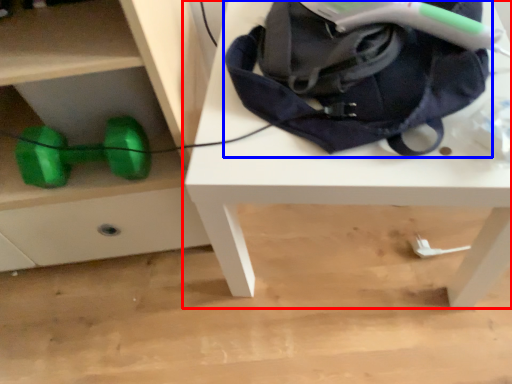
Question: Among these objects, which one is nearest to the camera, table (highlighted by a red box) or bag (highlighted by a blue box)?

Choices:
 (A) table
 (B) bag

Answer: (B)